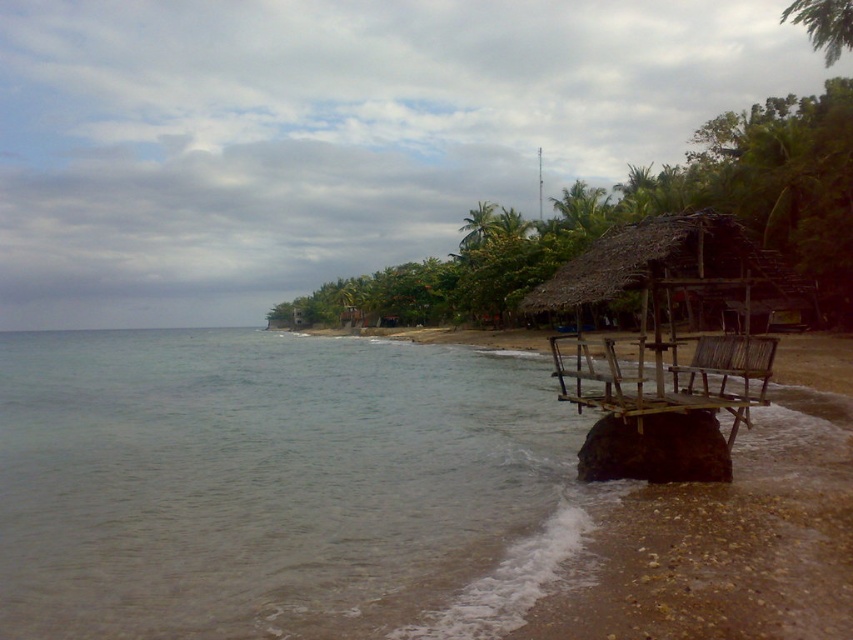
Measure the distance between thatched wood hut at right and green leafy palm tree at center.

They are 29.66 meters apart.

Is thatched wood hut at right positioned at the back of green leafy palm tree at center?

No.

Who is more distant from viewer, (724, 378) or (560, 211)?

Positioned behind is point (560, 211).

You are a GUI agent. You are given a task and a screenshot of the screen. Output one action in this format:
    pyautogui.click(x=<x>, y=<y>)
    Task: Click on the thatched wood hut at right
    The height and width of the screenshot is (640, 853).
    Given the screenshot: What is the action you would take?
    pyautogui.click(x=670, y=317)

Looking at this image, who is more distant from viewer, (498, 403) or (558, 196)?

Positioned behind is point (558, 196).

Is clear water at lower left below green leafy palm tree at center?

Yes.

What do you see at coordinates (277, 486) in the screenshot?
I see `clear water at lower left` at bounding box center [277, 486].

Where is `clear water at lower left`? The width and height of the screenshot is (853, 640). clear water at lower left is located at coordinates (277, 486).

Can you confirm if clear water at lower left is bigger than thatched wood hut at right?

Actually, clear water at lower left might be smaller than thatched wood hut at right.

The image size is (853, 640). What do you see at coordinates (277, 486) in the screenshot?
I see `clear water at lower left` at bounding box center [277, 486].

This screenshot has height=640, width=853. I want to click on clear water at lower left, so click(277, 486).